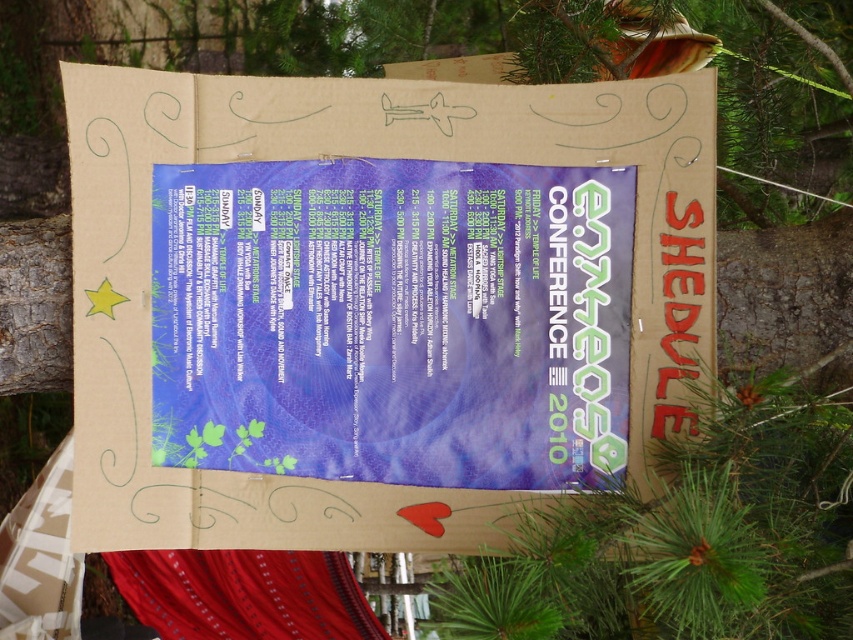
Does brown cardboard at center have a greater height compared to matte blue poster at center?

Yes, brown cardboard at center is taller than matte blue poster at center.

Measure the distance from brown cardboard at center to matte blue poster at center.

They are 0.52 inches apart.

Locate an element on the screen. brown cardboard at center is located at coordinates (375, 300).